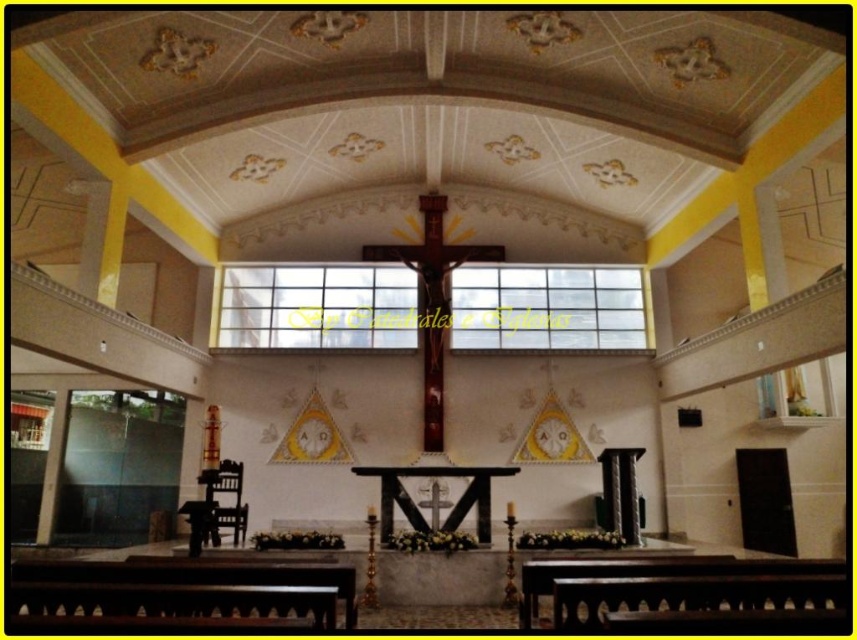
Does brown wooden bench at lower left have a lesser width compared to brown wooden bench at lower center?

No.

Locate an element on the screen. brown wooden bench at lower left is located at coordinates (201, 572).

Which is above, brown wooden bench at lower left or black polished wood altar at center?

brown wooden bench at lower left

Is brown wooden bench at lower left positioned before black polished wood altar at center?

Yes, it is in front of black polished wood altar at center.

Which is in front, point (111, 580) or point (379, 541)?

Point (111, 580)

Where is `brown wooden bench at lower left`? brown wooden bench at lower left is located at coordinates (201, 572).

Is brown wooden bench at lower center to the right of black polished wood altar at center from the viewer's perspective?

Indeed, brown wooden bench at lower center is positioned on the right side of black polished wood altar at center.

Is point (715, 554) positioned behind point (471, 483)?

Yes, it is.

Identify the location of brown wooden bench at lower center. This screenshot has width=857, height=640. (648, 570).